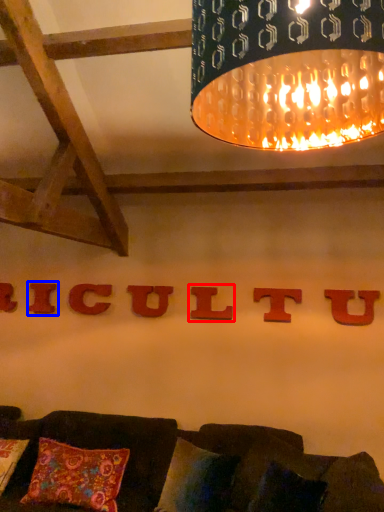
Question: Which point is further to the camera, alphabet (highlighted by a red box) or alphabet (highlighted by a blue box)?

Choices:
 (A) alphabet
 (B) alphabet

Answer: (B)